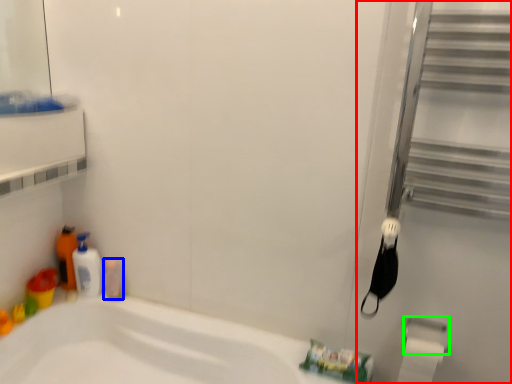
Question: Based on their relative distances, which object is nearer to screen door (highlighted by a red box)? Choose from toiletry (highlighted by a blue box) and towel bar (highlighted by a green box).

Choices:
 (A) toiletry
 (B) towel bar

Answer: (B)